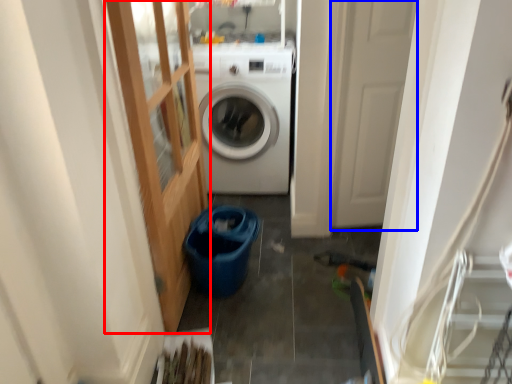
Question: Among these objects, which one is nearest to the camera, glass door (highlighted by a red box) or screen door (highlighted by a blue box)?

Choices:
 (A) glass door
 (B) screen door

Answer: (A)